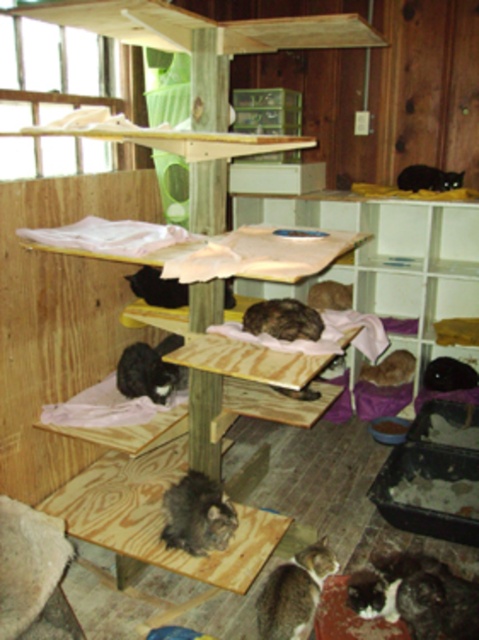
Question: Which of the following is the farthest from the observer?

Choices:
 (A) fuzzy brown cat at center
 (B) fluffy black-and-white cat at lower right
 (C) gray-furred cat at lower center

Answer: (A)

Question: Considering the relative positions of gray fluffy cat at center and black fur cat at upper right in the image provided, where is gray fluffy cat at center located with respect to black fur cat at upper right?

Choices:
 (A) right
 (B) left

Answer: (B)

Question: Can you confirm if fuzzy brown cat at center is positioned to the left of black fur cat at center?

Choices:
 (A) yes
 (B) no

Answer: (B)

Question: Which of the following is the closest to the observer?

Choices:
 (A) (448, 182)
 (B) (135, 273)

Answer: (B)

Question: Is fluffy black-and-white cat at lower right positioned at the back of fuzzy brown cat at center?

Choices:
 (A) no
 (B) yes

Answer: (A)

Question: Among these objects, which one is farthest from the camera?

Choices:
 (A) fuzzy brown cat at center
 (B) gray fluffy cat at center

Answer: (A)